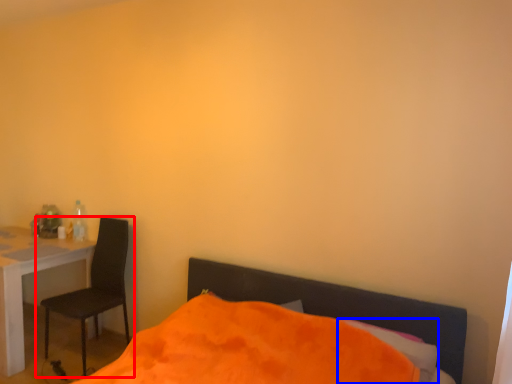
Question: Which object appears farthest to the camera in this image, chair (highlighted by a red box) or pillow (highlighted by a blue box)?

Choices:
 (A) chair
 (B) pillow

Answer: (A)